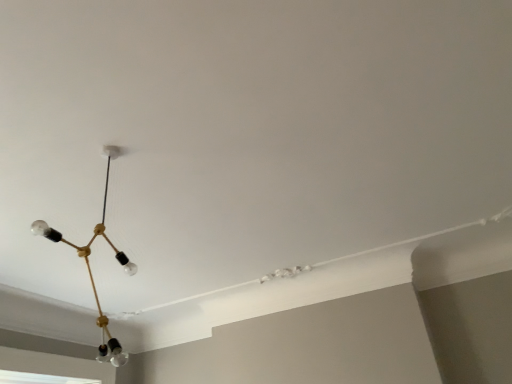
Question: Is gold metallic chandelier at upper left wider than transparent glass window at lower left?

Choices:
 (A) yes
 (B) no

Answer: (A)

Question: From a real-world perspective, is gold metallic chandelier at upper left physically above transparent glass window at lower left?

Choices:
 (A) no
 (B) yes

Answer: (B)

Question: Is gold metallic chandelier at upper left beside transparent glass window at lower left?

Choices:
 (A) no
 (B) yes

Answer: (A)

Question: Is gold metallic chandelier at upper left thinner than transparent glass window at lower left?

Choices:
 (A) no
 (B) yes

Answer: (A)

Question: Is the depth of gold metallic chandelier at upper left less than that of transparent glass window at lower left?

Choices:
 (A) yes
 (B) no

Answer: (A)

Question: Considering the relative positions of gold metallic chandelier at upper left and transparent glass window at lower left in the image provided, is gold metallic chandelier at upper left to the left of transparent glass window at lower left from the viewer's perspective?

Choices:
 (A) yes
 (B) no

Answer: (B)

Question: From a real-world perspective, does transparent glass window at lower left sit lower than gold metallic chandelier at upper left?

Choices:
 (A) no
 (B) yes

Answer: (B)

Question: From a real-world perspective, is transparent glass window at lower left located higher than gold metallic chandelier at upper left?

Choices:
 (A) yes
 (B) no

Answer: (B)

Question: Is transparent glass window at lower left taller than gold metallic chandelier at upper left?

Choices:
 (A) no
 (B) yes

Answer: (A)

Question: Would you say transparent glass window at lower left contains gold metallic chandelier at upper left?

Choices:
 (A) no
 (B) yes

Answer: (A)

Question: Considering the relative sizes of transparent glass window at lower left and gold metallic chandelier at upper left in the image provided, is transparent glass window at lower left wider than gold metallic chandelier at upper left?

Choices:
 (A) yes
 (B) no

Answer: (B)

Question: Is transparent glass window at lower left facing away from gold metallic chandelier at upper left?

Choices:
 (A) no
 (B) yes

Answer: (A)

Question: Is point (11, 382) positioned closer to the camera than point (103, 150)?

Choices:
 (A) farther
 (B) closer

Answer: (A)